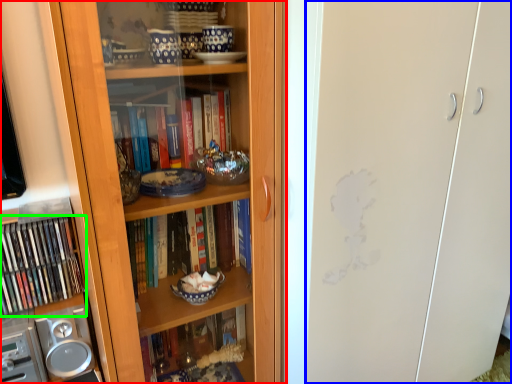
Question: Considering the real-world distances, which object is closest to bookcase (highlighted by a red box)? glass door (highlighted by a blue box) or book (highlighted by a green box).

Choices:
 (A) glass door
 (B) book

Answer: (A)